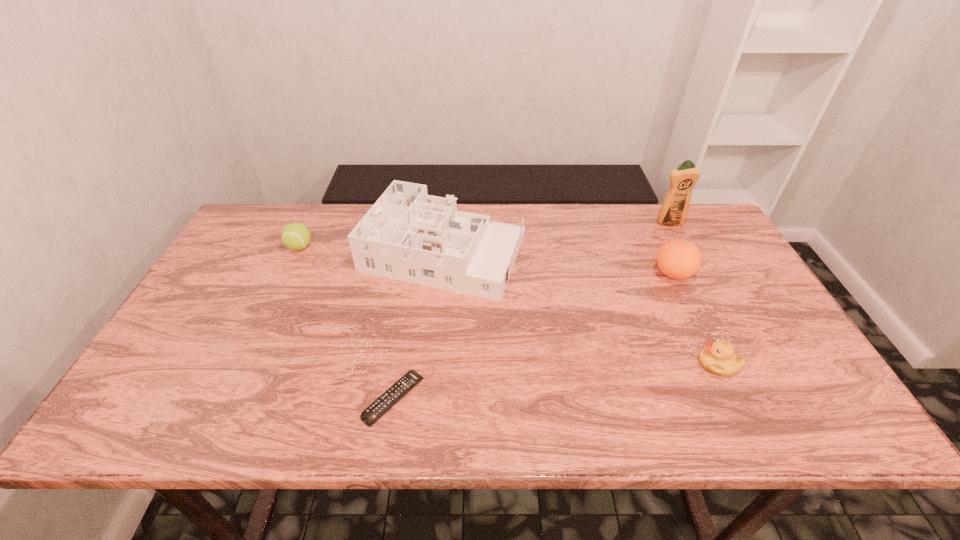
The height and width of the screenshot is (540, 960). Find the location of `vacant region between the dollhouse and the orange`. vacant region between the dollhouse and the orange is located at coordinates (559, 263).

Locate an element on the screen. Image resolution: width=960 pixels, height=540 pixels. unoccupied position between the orange and the dollhouse is located at coordinates (559, 263).

This screenshot has width=960, height=540. I want to click on free space between the orange and the duckling, so click(x=695, y=319).

Where is `vacant point located between the dollhouse and the remote control`? The image size is (960, 540). vacant point located between the dollhouse and the remote control is located at coordinates pos(419,326).

The image size is (960, 540). Identify the location of free space between the duckling and the leftmost object. (509, 305).

Find the location of a particular element. This screenshot has height=540, width=960. free spot between the orange and the duckling is located at coordinates click(x=695, y=319).

Where is `empty space that is in between the dollhouse and the remote control`? This screenshot has height=540, width=960. empty space that is in between the dollhouse and the remote control is located at coordinates (419, 326).

At what (x,y) coordinates should I click in order to perform the action: click on object that is the second closest to the tennis ball. Please return your answer as a coordinate pair (x, y). Looking at the image, I should click on click(x=390, y=397).

Choose which object is the nearest neighbor to the detergent. Please provide its 2D coordinates. Your answer should be formatted as a tuple, i.e. [(x, y)], where the tuple contains the x and y coordinates of a point satisfying the conditions above.

[(678, 259)]